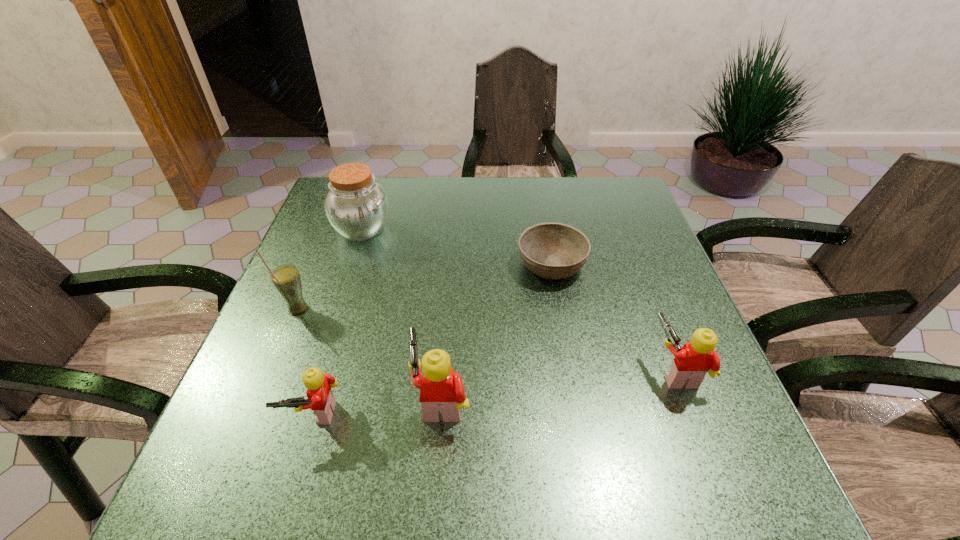
Find the location of `blank region between the jar and the leftmost Lego`. blank region between the jar and the leftmost Lego is located at coordinates (338, 322).

The width and height of the screenshot is (960, 540). In order to click on free space between the shortest object and the second Lego from left to right in this screenshot , I will do `click(496, 332)`.

Point out which object is positioned as the nearest to the jar. Please provide its 2D coordinates. Your answer should be formatted as a tuple, i.e. [(x, y)], where the tuple contains the x and y coordinates of a point satisfying the conditions above.

[(286, 279)]

This screenshot has width=960, height=540. Find the location of `object that stands as the second closest to the second object from right to left`. object that stands as the second closest to the second object from right to left is located at coordinates (442, 389).

You are a GUI agent. You are given a task and a screenshot of the screen. Output one action in this format:
    pyautogui.click(x=<x>, y=<y>)
    Task: Click on the Lego that stands as the closest to the shortest object
    The image size is (960, 540).
    Given the screenshot: What is the action you would take?
    pyautogui.click(x=691, y=363)

Choose which Lego is the nearest neighbor to the second Lego from left to right. Please provide its 2D coordinates. Your answer should be formatted as a tuple, i.e. [(x, y)], where the tuple contains the x and y coordinates of a point satisfying the conditions above.

[(321, 400)]

Find the location of a particular element. This screenshot has width=960, height=540. vacant space that satisfies the following two spatial constraints: 1. in front of the fourth object from left to right with the accessory visible; 2. in front of the shortest Lego with the accessory visible is located at coordinates (441, 414).

At what (x,y) coordinates should I click in order to perform the action: click on free spot that satisfies the following two spatial constraints: 1. in front of the second shortest Lego with the accessory visible; 2. in front of the shortest Lego with the accessory visible. Please return your answer as a coordinate pair (x, y). Image resolution: width=960 pixels, height=540 pixels. Looking at the image, I should click on (692, 414).